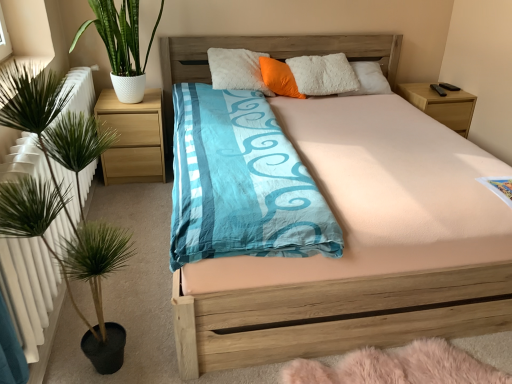
This screenshot has width=512, height=384. Describe the element at coordinates (121, 45) in the screenshot. I see `green leafy plant in white pot at left, which is the 2th houseplant from bottom to top` at that location.

What do you see at coordinates (337, 315) in the screenshot? I see `wooden bed at center` at bounding box center [337, 315].

This screenshot has width=512, height=384. What do you see at coordinates (37, 118) in the screenshot?
I see `green leafy plant at left, the 1th houseplant from the bottom` at bounding box center [37, 118].

Find the location of `light wood/finish nightstand at left, which ranks as the second nightstand in right-to-left order`. light wood/finish nightstand at left, which ranks as the second nightstand in right-to-left order is located at coordinates (133, 138).

Locate an element on the screen. bed that is on the right side of green leafy plant at left, marked as the 1th houseplant in a front-to-back arrangement is located at coordinates (337, 315).

Considering their positions, is green leafy plant at left, which ranks as the 2th houseplant in back-to-front order, located in front of or behind wooden bed at center?

green leafy plant at left, which ranks as the 2th houseplant in back-to-front order, is in front of wooden bed at center.

Is green leafy plant at left, marked as the 1th houseplant in a front-to-back arrangement, to the left of wooden bed at center from the viewer's perspective?

Yes.

Considering the relative sizes of green leafy plant at left, marked as the second houseplant in a top-to-bottom arrangement, and wooden bed at center in the image provided, is green leafy plant at left, marked as the second houseplant in a top-to-bottom arrangement, wider than wooden bed at center?

No.

Considering the relative sizes of light wood/finish nightstand at left, marked as the 1th nightstand in a left-to-right arrangement, and green leafy plant in white pot at left, which is the 2th houseplant from bottom to top, in the image provided, is light wood/finish nightstand at left, marked as the 1th nightstand in a left-to-right arrangement, smaller than green leafy plant in white pot at left, which is the 2th houseplant from bottom to top,?

Correct, light wood/finish nightstand at left, marked as the 1th nightstand in a left-to-right arrangement, occupies less space than green leafy plant in white pot at left, which is the 2th houseplant from bottom to top.

Looking at their sizes, would you say light wood/finish nightstand at left, marked as the 1th nightstand in a left-to-right arrangement, is wider or thinner than green leafy plant in white pot at left, which appears as the first houseplant when viewed from the top?

light wood/finish nightstand at left, marked as the 1th nightstand in a left-to-right arrangement, is thinner than green leafy plant in white pot at left, which appears as the first houseplant when viewed from the top.

Can you confirm if light wood/finish nightstand at left, marked as the 1th nightstand in a left-to-right arrangement, is shorter than green leafy plant in white pot at left, which is the 2th houseplant from bottom to top?

Yes.

Looking at this image, how far apart are light wood/finish nightstand at left, which ranks as the second nightstand in right-to-left order, and green leafy plant in white pot at left, the first houseplant positioned from the back?

light wood/finish nightstand at left, which ranks as the second nightstand in right-to-left order, and green leafy plant in white pot at left, the first houseplant positioned from the back, are 31.76 centimeters apart.

Which object is further away from the camera taking this photo, light wood/texture nightstand at right, which is the 2th nightstand from left to right, or orange fabric pillow at center?

light wood/texture nightstand at right, which is the 2th nightstand from left to right, is more distant.

Does light wood/texture nightstand at right, placed as the 1th nightstand when sorted from right to left, have a larger size compared to orange fabric pillow at center?

Indeed, light wood/texture nightstand at right, placed as the 1th nightstand when sorted from right to left, has a larger size compared to orange fabric pillow at center.

You are a GUI agent. You are given a task and a screenshot of the screen. Output one action in this format:
    pyautogui.click(x=<x>, y=<y>)
    Task: Click on the pillow that appears above the light wood/texture nightstand at right, placed as the 1th nightstand when sorted from right to left (from a real-world perspective)
    The height and width of the screenshot is (384, 512).
    Given the screenshot: What is the action you would take?
    pyautogui.click(x=279, y=78)

Is light wood/texture nightstand at right, which is the 2th nightstand from left to right, turned away from orange fabric pillow at center?

No, light wood/texture nightstand at right, which is the 2th nightstand from left to right, is not facing away from orange fabric pillow at center.

Locate an element on the screen. houseplant that is the 2nd one above the light wood/texture nightstand at right, placed as the 1th nightstand when sorted from right to left (from a real-world perspective) is located at coordinates (121, 45).

Considering the sizes of objects light wood/texture nightstand at right, placed as the 1th nightstand when sorted from right to left, and green leafy plant in white pot at left, the first houseplant positioned from the back, in the image provided, who is bigger, light wood/texture nightstand at right, placed as the 1th nightstand when sorted from right to left, or green leafy plant in white pot at left, the first houseplant positioned from the back,?

Bigger between the two is green leafy plant in white pot at left, the first houseplant positioned from the back.

Is light wood/texture nightstand at right, which is the 2th nightstand from left to right, placed right next to green leafy plant in white pot at left, the 2th houseplant when ordered from front to back?

They are not placed beside each other.

Is green leafy plant in white pot at left, the first houseplant positioned from the back, surrounded by light wood/texture nightstand at right, placed as the 1th nightstand when sorted from right to left?

Actually, green leafy plant in white pot at left, the first houseplant positioned from the back, is outside light wood/texture nightstand at right, placed as the 1th nightstand when sorted from right to left.

Locate an element on the screen. The height and width of the screenshot is (384, 512). pillow lying behind the light wood/finish nightstand at left, marked as the 1th nightstand in a left-to-right arrangement is located at coordinates tap(279, 78).

Considering the relative positions of orange fabric pillow at center and light wood/finish nightstand at left, which ranks as the second nightstand in right-to-left order, in the image provided, is orange fabric pillow at center to the right of light wood/finish nightstand at left, which ranks as the second nightstand in right-to-left order, from the viewer's perspective?

Correct, you'll find orange fabric pillow at center to the right of light wood/finish nightstand at left, which ranks as the second nightstand in right-to-left order.

Can we say orange fabric pillow at center lies outside light wood/finish nightstand at left, marked as the 1th nightstand in a left-to-right arrangement?

Indeed, orange fabric pillow at center is completely outside light wood/finish nightstand at left, marked as the 1th nightstand in a left-to-right arrangement.

Is orange fabric pillow at center far from light wood/finish nightstand at left, which ranks as the second nightstand in right-to-left order?

Actually, orange fabric pillow at center and light wood/finish nightstand at left, which ranks as the second nightstand in right-to-left order, are a little close together.

Which of these two, light wood/finish nightstand at left, which ranks as the second nightstand in right-to-left order, or light wood/texture nightstand at right, placed as the 1th nightstand when sorted from right to left, stands taller?

light wood/finish nightstand at left, which ranks as the second nightstand in right-to-left order.

This screenshot has height=384, width=512. In order to click on nightstand above the light wood/finish nightstand at left, which ranks as the second nightstand in right-to-left order (from a real-world perspective) in this screenshot , I will do `click(441, 105)`.

Who is bigger, light wood/finish nightstand at left, which ranks as the second nightstand in right-to-left order, or light wood/texture nightstand at right, which is the 2th nightstand from left to right?

With larger size is light wood/finish nightstand at left, which ranks as the second nightstand in right-to-left order.

From the image's perspective, which one is positioned lower, light wood/finish nightstand at left, which ranks as the second nightstand in right-to-left order, or light wood/texture nightstand at right, placed as the 1th nightstand when sorted from right to left?

light wood/finish nightstand at left, which ranks as the second nightstand in right-to-left order, appears lower in the image.

Does green leafy plant at left, the 1th houseplant from the bottom, have a greater width compared to orange fabric pillow at center?

Correct, the width of green leafy plant at left, the 1th houseplant from the bottom, exceeds that of orange fabric pillow at center.

From the image's perspective, is green leafy plant at left, the 1th houseplant from the bottom, located beneath orange fabric pillow at center?

Indeed, from the image's perspective, green leafy plant at left, the 1th houseplant from the bottom, is shown beneath orange fabric pillow at center.

Can you tell me how much green leafy plant at left, which ranks as the 2th houseplant in back-to-front order, and orange fabric pillow at center differ in facing direction?

42.1 degrees.

Is orange fabric pillow at center a part of green leafy plant at left, the 1th houseplant from the bottom?

Definitely not — orange fabric pillow at center is not inside green leafy plant at left, the 1th houseplant from the bottom.

You are a GUI agent. You are given a task and a screenshot of the screen. Output one action in this format:
    pyautogui.click(x=<x>, y=<y>)
    Task: Click on the 1st houseplant positioned above the wooden bed at center (from a real-world perspective)
    The image size is (512, 384).
    Given the screenshot: What is the action you would take?
    pyautogui.click(x=37, y=118)

Where is `the 1st houseplant counting from the right side of the light wood/finish nightstand at left, which ranks as the second nightstand in right-to-left order`? the 1st houseplant counting from the right side of the light wood/finish nightstand at left, which ranks as the second nightstand in right-to-left order is located at coordinates (121, 45).

Which object lies further to the anchor point light wood/finish nightstand at left, which ranks as the second nightstand in right-to-left order, green leafy plant at left, which ranks as the 2th houseplant in back-to-front order, or light wood/texture nightstand at right, which is the 2th nightstand from left to right?

light wood/texture nightstand at right, which is the 2th nightstand from left to right.

When comparing their distances from green leafy plant at left, the 1th houseplant from the bottom, does light wood/finish nightstand at left, which ranks as the second nightstand in right-to-left order, or wooden bed at center seem closer?

The object closer to green leafy plant at left, the 1th houseplant from the bottom, is wooden bed at center.

From the image, which object appears to be nearer to wooden bed at center, green leafy plant in white pot at left, the 2th houseplant when ordered from front to back, or light wood/finish nightstand at left, which ranks as the second nightstand in right-to-left order?

light wood/finish nightstand at left, which ranks as the second nightstand in right-to-left order, lies closer to wooden bed at center than the other object.

Looking at the image, which one is located closer to green leafy plant in white pot at left, which is the 2th houseplant from bottom to top, wooden bed at center or orange fabric pillow at center?

Result: The object closer to green leafy plant in white pot at left, which is the 2th houseplant from bottom to top, is orange fabric pillow at center.

Which object lies nearer to the anchor point wooden bed at center, green leafy plant in white pot at left, the 2th houseplant when ordered from front to back, or orange fabric pillow at center?

The object closer to wooden bed at center is green leafy plant in white pot at left, the 2th houseplant when ordered from front to back.

Based on their spatial positions, is wooden bed at center or light wood/texture nightstand at right, which is the 2th nightstand from left to right, further from green leafy plant at left, marked as the 1th houseplant in a front-to-back arrangement?

The object further to green leafy plant at left, marked as the 1th houseplant in a front-to-back arrangement, is light wood/texture nightstand at right, which is the 2th nightstand from left to right.

Estimate the real-world distances between objects in this image. Which object is closer to orange fabric pillow at center, light wood/texture nightstand at right, which is the 2th nightstand from left to right, or wooden bed at center?

Among the two, light wood/texture nightstand at right, which is the 2th nightstand from left to right, is located nearer to orange fabric pillow at center.

Estimate the real-world distances between objects in this image. Which object is closer to light wood/texture nightstand at right, placed as the 1th nightstand when sorted from right to left, orange fabric pillow at center or green leafy plant at left, which ranks as the 2th houseplant in back-to-front order?

orange fabric pillow at center lies closer to light wood/texture nightstand at right, placed as the 1th nightstand when sorted from right to left, than the other object.

Identify the location of pillow positioned between wooden bed at center and light wood/texture nightstand at right, placed as the 1th nightstand when sorted from right to left, from near to far. (279, 78).

Where is `houseplant positioned between green leafy plant at left, the 1th houseplant from the bottom, and orange fabric pillow at center from near to far`? This screenshot has width=512, height=384. houseplant positioned between green leafy plant at left, the 1th houseplant from the bottom, and orange fabric pillow at center from near to far is located at coordinates (121, 45).

Find the location of a particular element. The height and width of the screenshot is (384, 512). houseplant situated between green leafy plant in white pot at left, which appears as the first houseplant when viewed from the top, and light wood/texture nightstand at right, placed as the 1th nightstand when sorted from right to left, from left to right is located at coordinates (37, 118).

Locate an element on the screen. nightstand positioned between green leafy plant at left, marked as the 1th houseplant in a front-to-back arrangement, and orange fabric pillow at center from near to far is located at coordinates (133, 138).